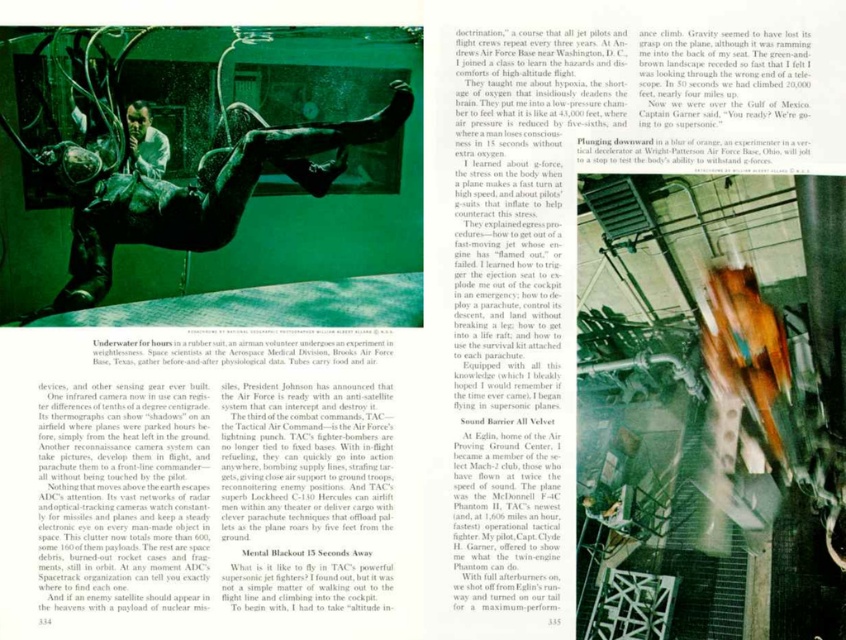
Is green matte man at center wider than matte black helmet at upper center?

Correct, the width of green matte man at center exceeds that of matte black helmet at upper center.

How far apart are green matte man at center and matte black helmet at upper center?

green matte man at center is 1.34 meters from matte black helmet at upper center.

What do you see at coordinates (205, 196) in the screenshot?
I see `green matte man at center` at bounding box center [205, 196].

Locate an element on the screen. The width and height of the screenshot is (846, 640). green matte man at center is located at coordinates (205, 196).